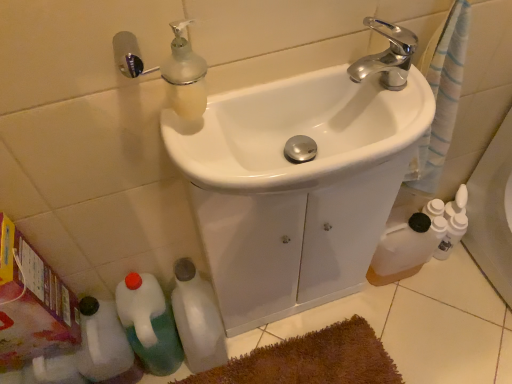
This screenshot has width=512, height=384. I want to click on free spot below brown plush bath mat at lower center (from a real-world perspective), so click(302, 365).